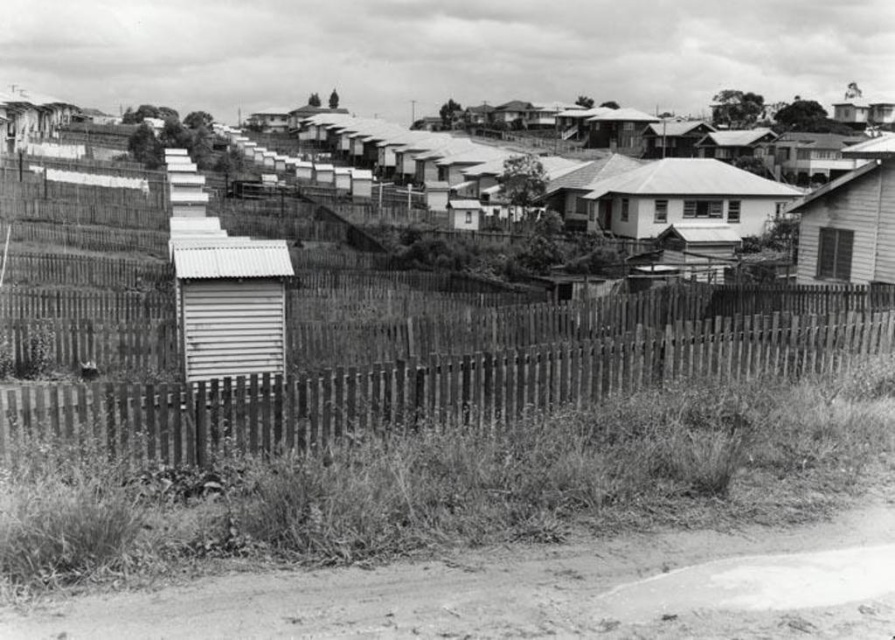
Question: Which point is farther to the camera?

Choices:
 (A) white corrugated metal hut at center
 (B) wooden picket fence at center

Answer: (A)

Question: Does white corrugated metal hut at center appear over wooden shack at right?

Choices:
 (A) no
 (B) yes

Answer: (A)

Question: Which of the following is the farthest from the observer?

Choices:
 (A) dirt track at lower center
 (B) white corrugated metal hut at center
 (C) wooden shack at right

Answer: (C)

Question: Is wooden picket fence at center above wooden shack at right?

Choices:
 (A) no
 (B) yes

Answer: (A)

Question: In this image, where is dirt track at lower center located relative to wooden picket fence at center?

Choices:
 (A) below
 (B) above

Answer: (A)

Question: Estimate the real-world distances between objects in this image. Which object is closer to the smooth white house at center?

Choices:
 (A) dirt track at lower center
 (B) white corrugated metal hut at center

Answer: (B)